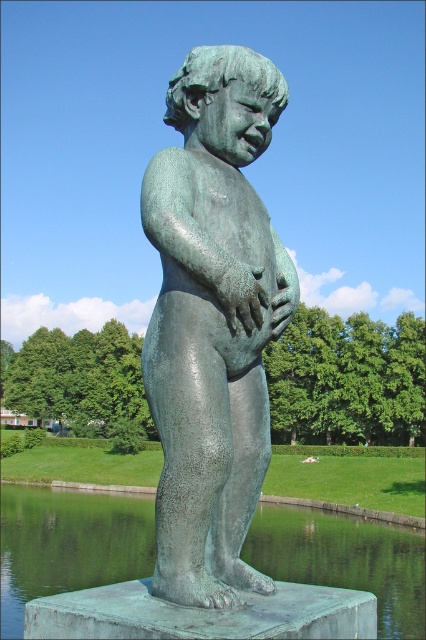
Is point (192, 397) positioned behind point (299, 512)?

That is False.

This screenshot has width=426, height=640. Describe the element at coordinates (213, 321) in the screenshot. I see `green patina statue at center` at that location.

Which is behind, point (166, 506) or point (262, 557)?

The point (262, 557) is behind.

Find the location of a particular element. green patina statue at center is located at coordinates (213, 321).